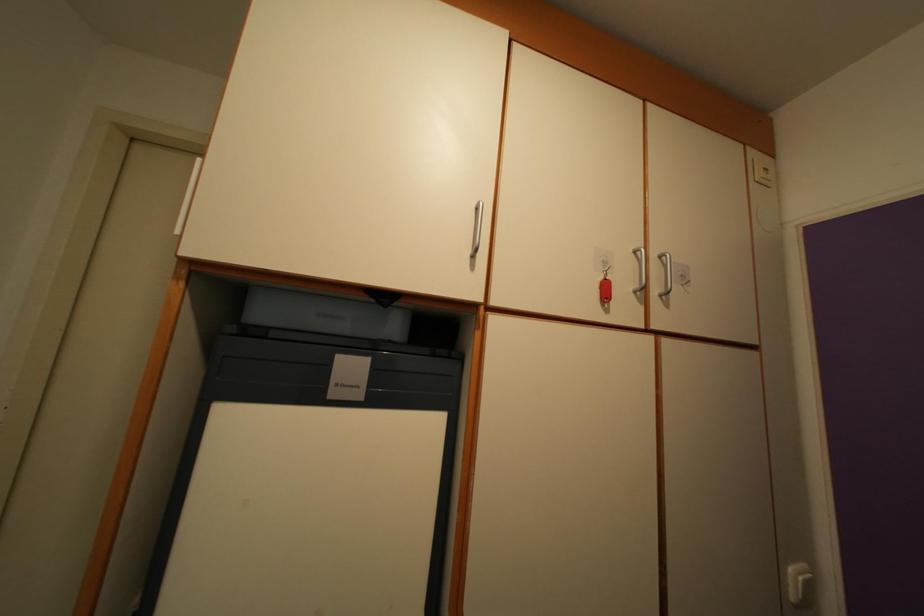
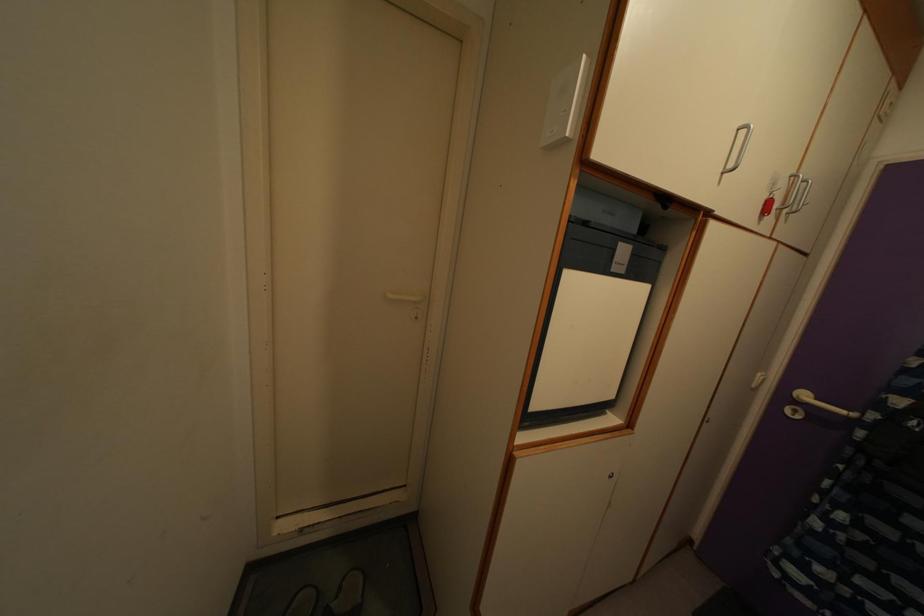
Question: What movement of the cameraman would produce the second image?

Choices:
 (A) Left
 (B) Right
 (C) Forward
 (D) Backward

Answer: (A)